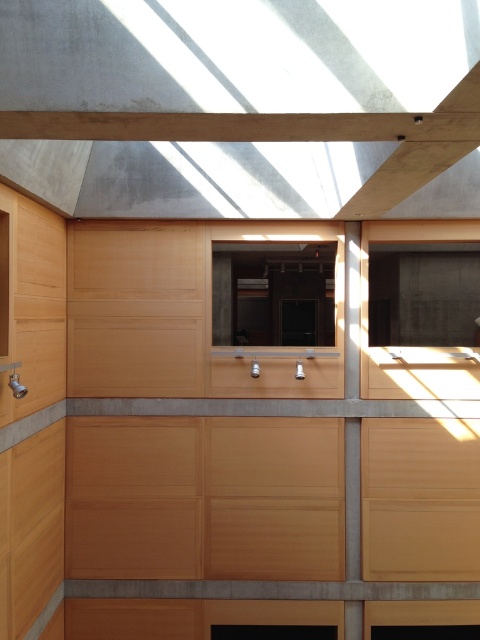
You are standing in the room and want to look outside. Which window would allow you to see more of the outside view, the transparent glass window at center or the matte wood window at center?

The transparent glass window at center is more transparent than the matte wood window at center, so it allows a clearer view outside.

Based on the photo, you are standing at point (324, 280) in the room. The nearest exit is 16.54 meters away. Can you reach the exit in 10 seconds if you walk at 1.5 m per second?

The distance to the exit is 16.54 meters. Walking at 1.5 m per second, you would need 16.54 divided by 1.5, which is approximately 11.03 seconds. Since 11.03 seconds is longer than 10 seconds, you cannot reach the exit in time.